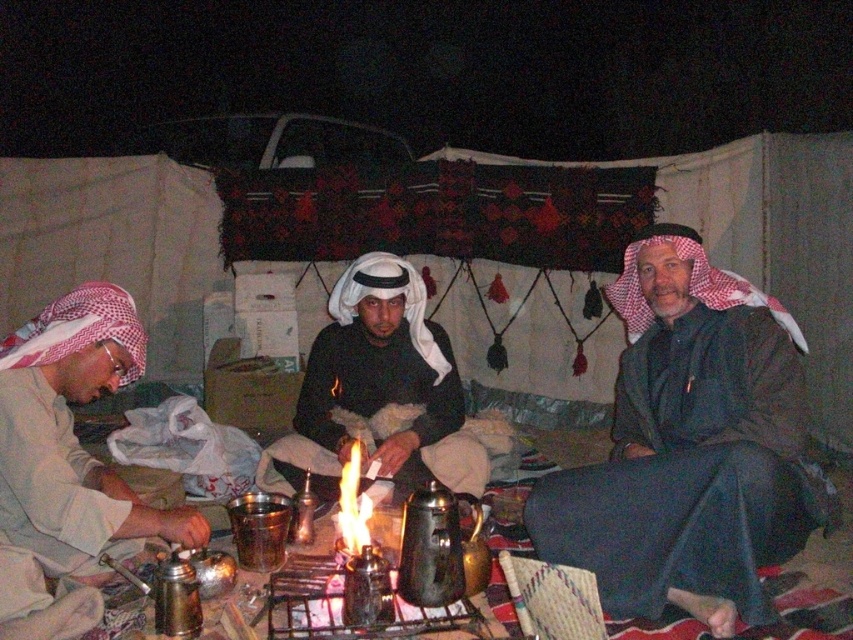
Is point (624, 282) positioned behind point (380, 285)?

No, (624, 282) is in front of (380, 285).

Does dark green fabric at center appear over white matte cloth at center?

No, dark green fabric at center is not above white matte cloth at center.

This screenshot has height=640, width=853. What are the coordinates of `dark green fabric at center` in the screenshot? It's located at (688, 445).

The width and height of the screenshot is (853, 640). In order to click on dark green fabric at center in this screenshot , I will do `click(688, 445)`.

Does dark green fabric at center have a lesser width compared to white fabric headscarf at left?

Incorrect, dark green fabric at center's width is not less than white fabric headscarf at left's.

Is point (630, 392) closer to viewer compared to point (91, 342)?

No, (630, 392) is further to viewer.

Which is behind, point (624, 376) or point (164, 529)?

Point (624, 376)

At what (x,y) coordinates should I click in order to perform the action: click on dark green fabric at center. Please return your answer as a coordinate pair (x, y). The image size is (853, 640). Looking at the image, I should click on (688, 445).

Is point (103, 358) closer to camera compared to point (393, 292)?

Yes.

Which is below, white fabric headscarf at left or white matte cloth at center?

white fabric headscarf at left is below.

Is point (28, 472) closer to camera compared to point (408, 403)?

Yes, it is in front of point (408, 403).

This screenshot has width=853, height=640. In order to click on white fabric headscarf at left in this screenshot , I will do `click(73, 435)`.